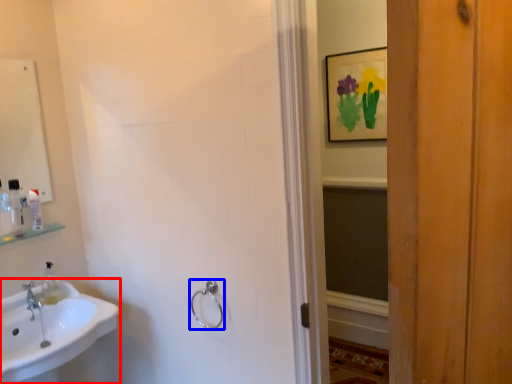
Question: Which point is further to the camera, sink (highlighted by a red box) or towel rack (highlighted by a blue box)?

Choices:
 (A) sink
 (B) towel rack

Answer: (B)